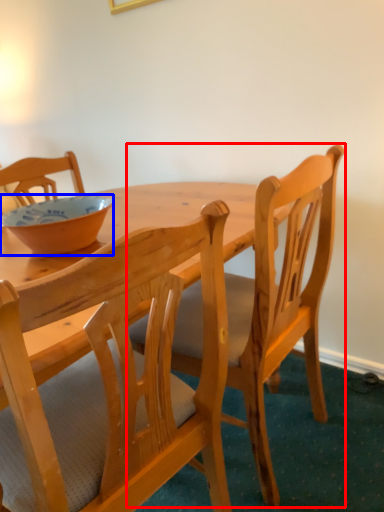
Question: Which point is closer to the camera, chair (highlighted by a red box) or bowl (highlighted by a blue box)?

Choices:
 (A) chair
 (B) bowl

Answer: (A)